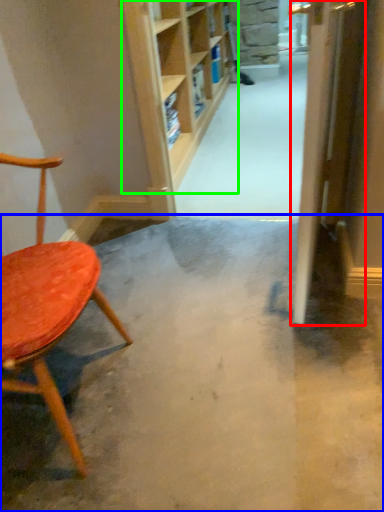
Question: Considering the real-world distances, which object is closest to door (highlighted by a red box)? concrete (highlighted by a blue box) or shelf (highlighted by a green box).

Choices:
 (A) concrete
 (B) shelf

Answer: (A)